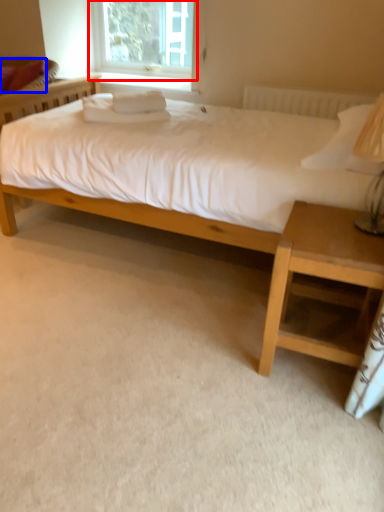
Question: Which of the following is the farthest to the observer, window (highlighted by a red box) or pillow (highlighted by a blue box)?

Choices:
 (A) window
 (B) pillow

Answer: (A)